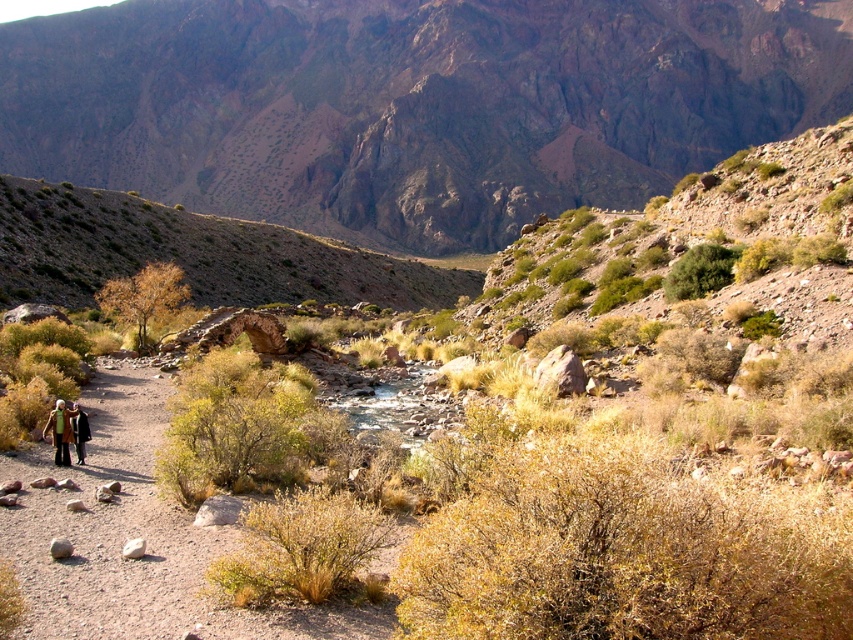
Is the position of rugged rock mountain at upper center less distant than that of golden dry bush at center?

No, rugged rock mountain at upper center is behind golden dry bush at center.

Which is below, rugged rock mountain at upper center or golden dry bush at center?

golden dry bush at center is lower down.

You are a GUI agent. You are given a task and a screenshot of the screen. Output one action in this format:
    pyautogui.click(x=<x>, y=<y>)
    Task: Click on the rugged rock mountain at upper center
    The image size is (853, 640).
    Given the screenshot: What is the action you would take?
    pyautogui.click(x=412, y=104)

Does golden dry bush at center have a lesser height compared to camouflage fabric jacket at lower left?

No.

Can you confirm if golden dry bush at center is taller than camouflage fabric jacket at lower left?

Indeed, golden dry bush at center has a greater height compared to camouflage fabric jacket at lower left.

Identify the location of golden dry bush at center. (144, 296).

Find the location of a particular element. The image size is (853, 640). golden dry bush at center is located at coordinates (144, 296).

Does point (828, 84) lie behind point (53, 416)?

That is True.

Who is lower down, rugged rock mountain at upper center or camouflage fabric jacket at lower left?

camouflage fabric jacket at lower left is lower down.

Is point (451, 109) in front of point (56, 465)?

No, (451, 109) is behind (56, 465).

Locate an element on the screen. rugged rock mountain at upper center is located at coordinates (412, 104).